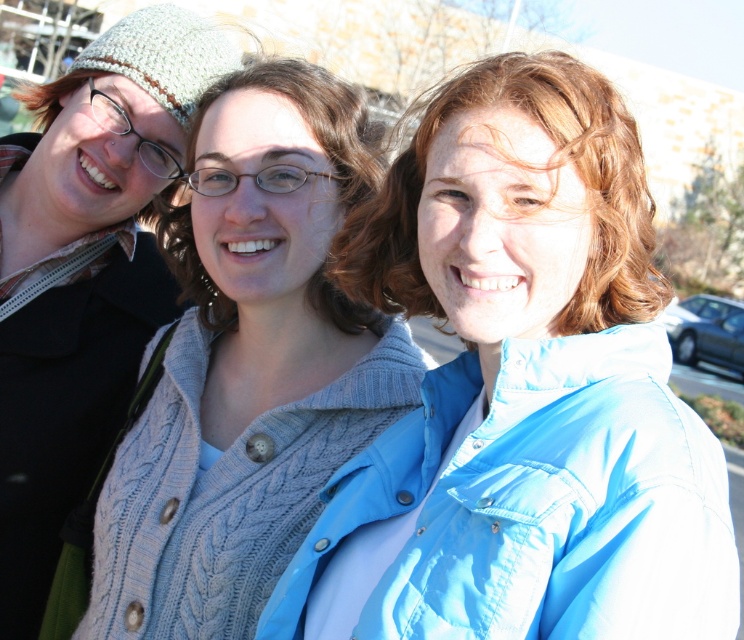
Question: Which point appears closest to the camera in this image?

Choices:
 (A) (246, 406)
 (B) (478, 468)

Answer: (B)

Question: Is knitted gray sweater at center positioned behind knitted sweater at center?

Choices:
 (A) no
 (B) yes

Answer: (A)

Question: Is blue quilted jacket at center smaller than knitted gray sweater at center?

Choices:
 (A) no
 (B) yes

Answer: (A)

Question: Which point appears farthest from the camera in this image?

Choices:
 (A) (548, 188)
 (B) (217, 58)
 (C) (391, 228)
 (D) (266, 160)

Answer: (B)

Question: Does blue quilted jacket at center have a greater width compared to knitted gray sweater at center?

Choices:
 (A) yes
 (B) no

Answer: (B)

Question: Which point is farther to the camera?

Choices:
 (A) light brown hair at center
 (B) knitted sweater at center

Answer: (B)